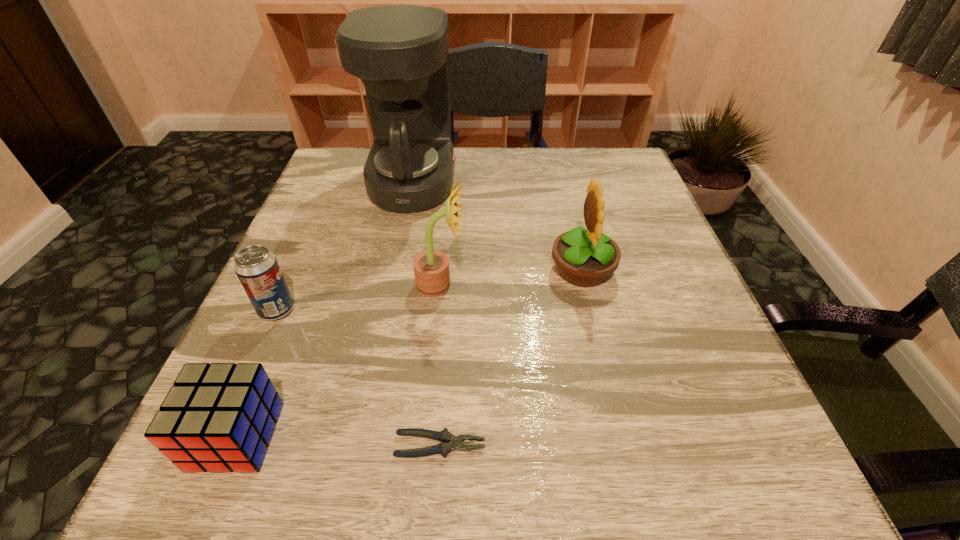
Where is `cube located at the left edge`? This screenshot has width=960, height=540. cube located at the left edge is located at coordinates (220, 417).

Locate an element on the screen. object that is at the right edge is located at coordinates coord(585,258).

Locate an element on the screen. This screenshot has width=960, height=540. object that is at the far left corner is located at coordinates (400, 52).

In order to click on object at the near left corner in this screenshot , I will do `click(220, 417)`.

Find the location of a particular element. This screenshot has width=960, height=540. vacant space at the far edge of the desktop is located at coordinates (478, 148).

In the image, there is a desktop. Identify the location of vacant area at the near edge. This screenshot has width=960, height=540. (472, 499).

The image size is (960, 540). In the image, there is a desktop. What are the coordinates of `vacant space at the left edge` in the screenshot? It's located at (358, 199).

Locate an element on the screen. The width and height of the screenshot is (960, 540). vacant space at the right edge is located at coordinates (665, 279).

The image size is (960, 540). What are the coordinates of `free space at the far left corner of the desktop` in the screenshot? It's located at (334, 176).

The width and height of the screenshot is (960, 540). Identify the location of free location at the far right corner. (583, 198).